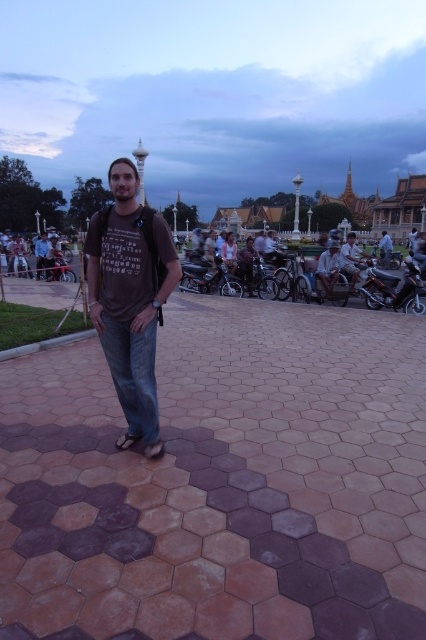
Which is behind, point (111, 342) or point (39, 268)?

The point (39, 268) is more distant.

Is point (94, 221) behind point (45, 269)?

No, (94, 221) is closer to viewer.

This screenshot has height=640, width=426. I want to click on matte brown t-shirt at center, so click(131, 298).

Can you confirm if brown hexagonal tiles at center is wider than blue denim jeans at center?

In fact, brown hexagonal tiles at center might be narrower than blue denim jeans at center.

Is brown hexagonal tiles at center bigger than blue denim jeans at center?

No.

Between point (420, 513) and point (391, 252), which one is positioned behind?

Point (391, 252)

The height and width of the screenshot is (640, 426). Identify the location of brown hexagonal tiles at center. (221, 481).

Which is more to the left, matte brown t-shirt at center or metallic silver motorcycle at center?

From the viewer's perspective, matte brown t-shirt at center appears more on the left side.

Describe the element at coordinates (131, 298) in the screenshot. I see `matte brown t-shirt at center` at that location.

Does point (143, 252) lie in front of point (196, 280)?

Yes, point (143, 252) is closer to viewer.

The image size is (426, 640). In order to click on matte brown t-shirt at center in this screenshot , I will do `click(131, 298)`.